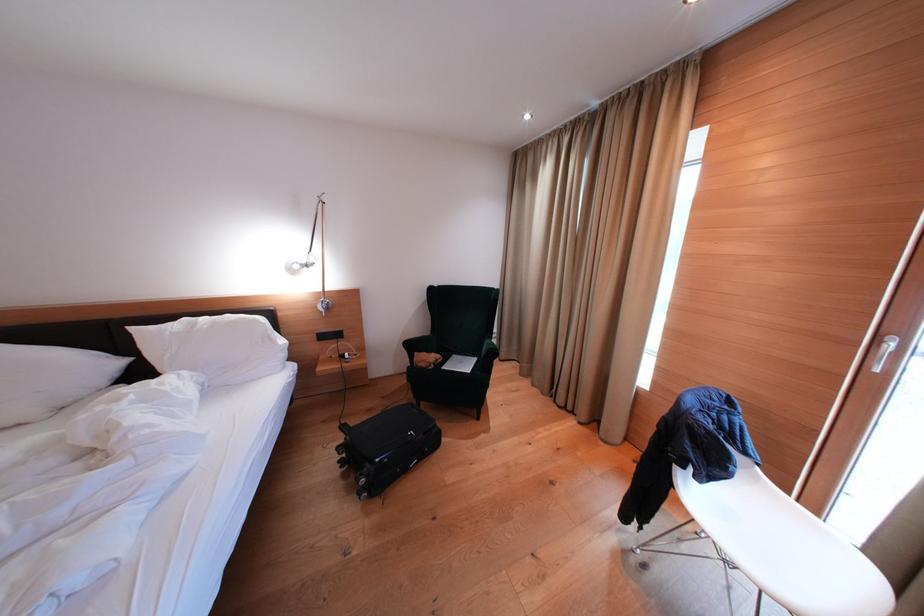
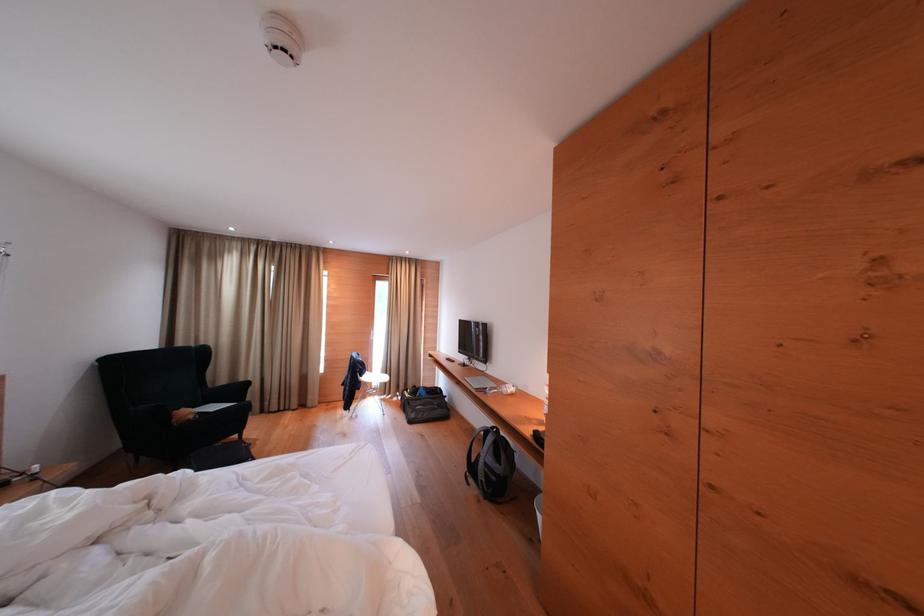
In the second image, find the point that corresponds to pixel 430 369 in the first image.

(198, 421)